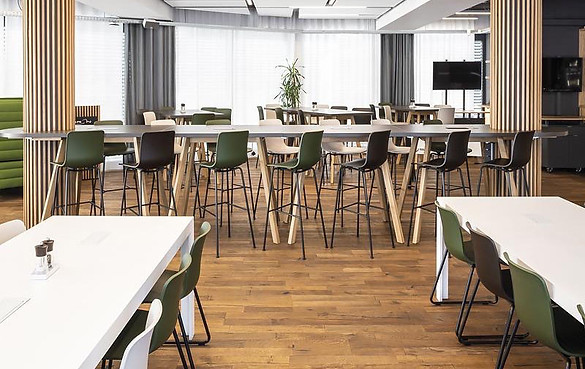
Locate an element on the screen. This screenshot has width=585, height=369. table is located at coordinates (132, 270), (554, 248), (175, 114), (191, 127), (338, 113), (425, 108), (472, 110).